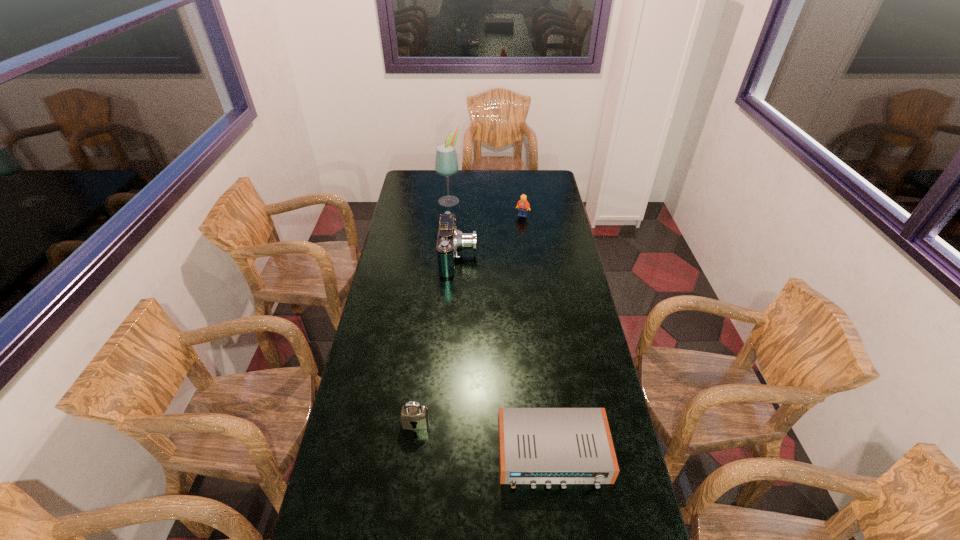
You are a GUI agent. You are given a task and a screenshot of the screen. Output one action in this format:
    pyautogui.click(x=<x>, y=<y>)
    Task: Click on the vacant point located 0.190m at the front of the padlock near the keyhole
    The width and height of the screenshot is (960, 540).
    Given the screenshot: What is the action you would take?
    pyautogui.click(x=407, y=495)

You are a GUI agent. You are given a task and a screenshot of the screen. Output one action in this format:
    pyautogui.click(x=<x>, y=<y>)
    Task: Click on the vacant region located 0.120m on the front panel of the radio receiver
    Image resolution: width=960 pixels, height=540 pixels.
    Given the screenshot: What is the action you would take?
    pyautogui.click(x=564, y=538)

Find the location of a particular element. This screenshot has height=540, width=960. object at the right edge is located at coordinates (548, 446).

Where is `vacant area at the far edge of the desktop`? vacant area at the far edge of the desktop is located at coordinates (475, 188).

Locate an element on the screen. The width and height of the screenshot is (960, 540). free space at the left edge of the desktop is located at coordinates (375, 293).

Where is `free location at the right edge of the desktop`? The image size is (960, 540). free location at the right edge of the desktop is located at coordinates click(x=608, y=490).

In the image, there is a desktop. Where is `free space at the far left corner`? free space at the far left corner is located at coordinates (421, 176).

Identify the location of free spot at the far right corner of the desktop. (538, 180).

This screenshot has width=960, height=540. What are the coordinates of `free space between the shortest object and the alcohol` in the screenshot? It's located at (501, 327).

Locate an element on the screen. This screenshot has width=960, height=540. empty location between the fourth nearest object and the camcorder is located at coordinates (491, 237).